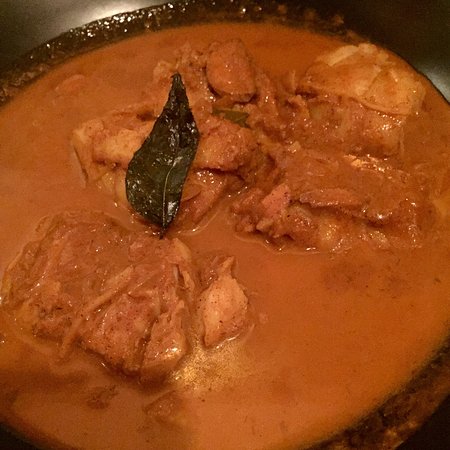
Image resolution: width=450 pixels, height=450 pixels. What are the coordinates of `lower right rim of bowl` in the screenshot? It's located at (371, 440).